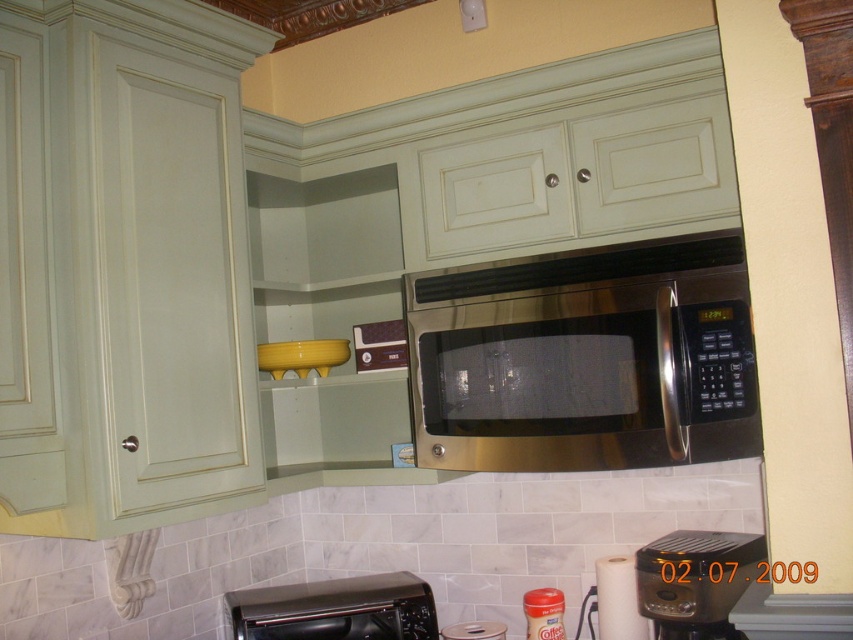
You are arranging kitchen items and need to place a new spice jar. The spice jar is 15 cm tall. The space between the stainless steel microwave at center and the black plastic toaster oven at lower center is 20 cm. Can the spice jar fit vertically in that space?

The space between the stainless steel microwave at center and the black plastic toaster oven at lower center is 20 cm. Since the spice jar is only 15 cm tall, it can fit vertically in that space.

You are organizing the kitchen and need to place both the black plastic toaster oven at lower center and the black plastic coffee maker at lower center on a shelf. The shelf can only hold items up to the size of the toaster oven. Can both items fit on the shelf?

The black plastic toaster oven at lower center is larger than the black plastic coffee maker at lower center. Since the shelf can hold items up to the size of the toaster oven, the coffee maker will fit, but the toaster oven itself may take up most of the space. However, both items can technically fit as the coffee maker is smaller.

You are a home assistant and need to place a new spice jar between the stainless steel microwave at center and the black plastic coffee maker at lower center. Which side of the microwave should you place it on to ensure it is between them?

The stainless steel microwave at center is to the left of the black plastic coffee maker at lower center, so placing the spice jar to the right side of the microwave would position it between them.